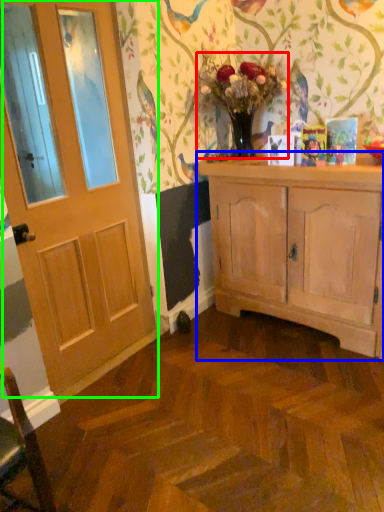
Question: Which is farther away from floral arrangement (highlighted by a red box)? cabinetry (highlighted by a blue box) or door (highlighted by a green box)?

Choices:
 (A) cabinetry
 (B) door

Answer: (B)